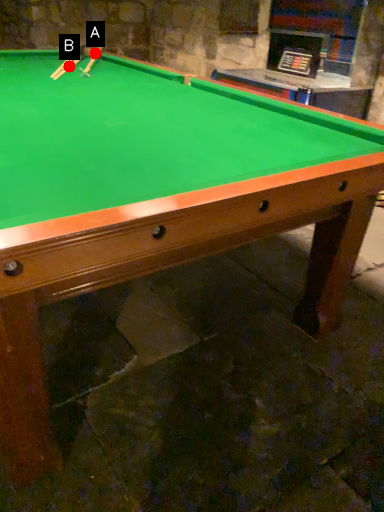
Question: Two points are circled on the image, labeled by A and B beside each circle. Which point appears closest to the camera in this image?

Choices:
 (A) A is closer
 (B) B is closer

Answer: (B)